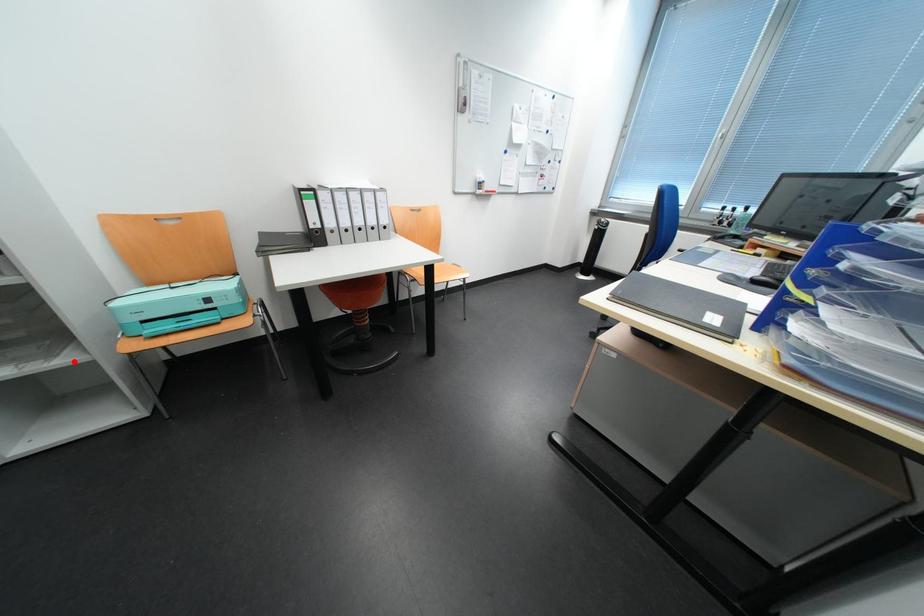
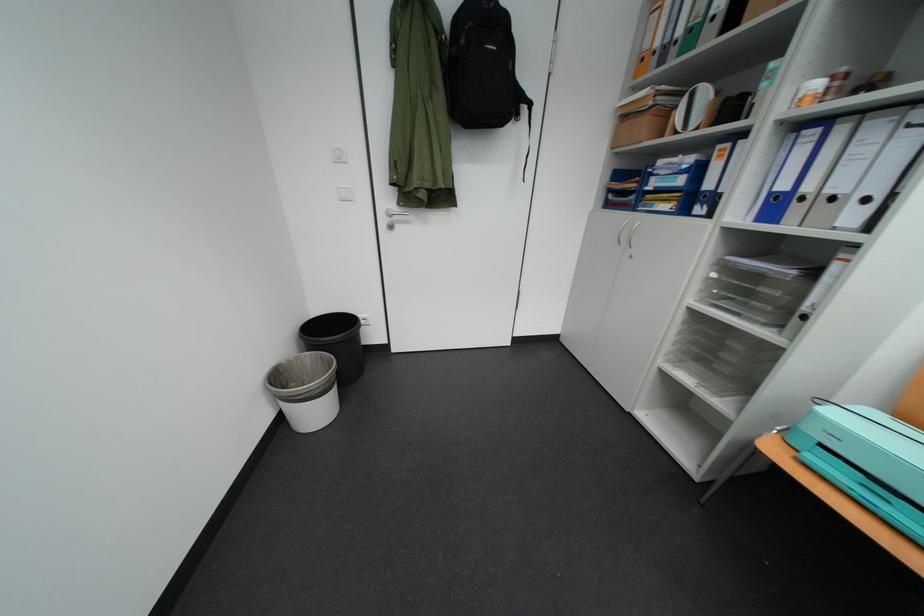
In the second image, find the point that corresponds to the highlighted location in the first image.

(730, 403)